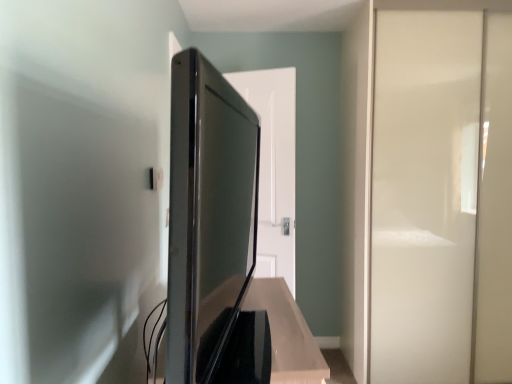
Question: Is white glossy door at center wider or thinner than white glossy screen door at right?

Choices:
 (A) wide
 (B) thin

Answer: (B)

Question: Based on their sizes in the image, would you say white glossy door at center is bigger or smaller than white glossy screen door at right?

Choices:
 (A) small
 (B) big

Answer: (A)

Question: Considering the real-world distances, which object is closest to the satin black tv at center?

Choices:
 (A) white glossy screen door at right
 (B) white glossy door at center

Answer: (B)

Question: Which object is the farthest from the white glossy door at center?

Choices:
 (A) satin black tv at center
 (B) white glossy screen door at right

Answer: (A)